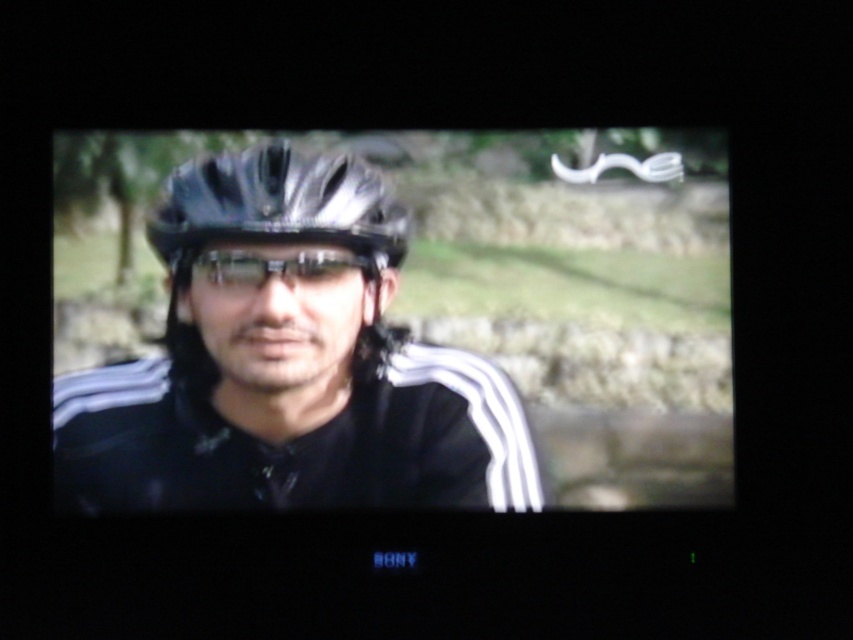
Between matte black helmet at center and black matte helmet at center, which one has more height?

With more height is matte black helmet at center.

Is matte black helmet at center positioned behind black matte helmet at center?

No.

Who is more distant from viewer, (283, 481) or (201, 157)?

A: The point (201, 157) is more distant.

Find the location of a particular element. matte black helmet at center is located at coordinates pos(287,362).

Is matte black helmet at center shorter than transparent plastic goggles at center?

No, matte black helmet at center is not shorter than transparent plastic goggles at center.

Who is more distant from viewer, (369, 300) or (312, 253)?

The point (369, 300) is more distant.

Who is more forward, (306,465) or (317,275)?

Positioned in front is point (306,465).

At what (x,y) coordinates should I click in order to perform the action: click on matte black helmet at center. Please return your answer as a coordinate pair (x, y). The height and width of the screenshot is (640, 853). Looking at the image, I should click on (287, 362).

Between point (376, 225) and point (337, 259), which one is positioned in front?

Positioned in front is point (337, 259).

Does black matte helmet at center have a lesser width compared to transparent plastic goggles at center?

Result: No.

Measure the distance between point (172, 282) and camera.

Point (172, 282) and camera are 2.62 meters apart.

Where is `black matte helmet at center`? The image size is (853, 640). black matte helmet at center is located at coordinates (276, 236).